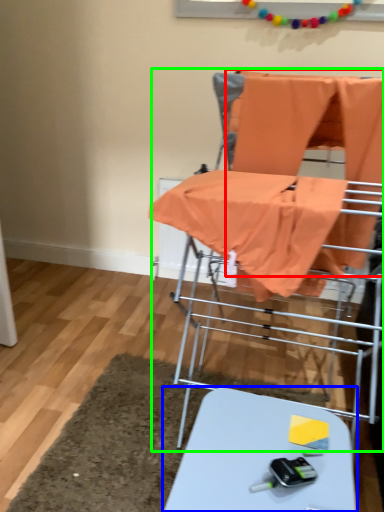
Question: Which object is the closest to the fabric (highlighted by a red box)? Choose among these: table (highlighted by a blue box) or baby carriage (highlighted by a green box).

Choices:
 (A) table
 (B) baby carriage

Answer: (B)